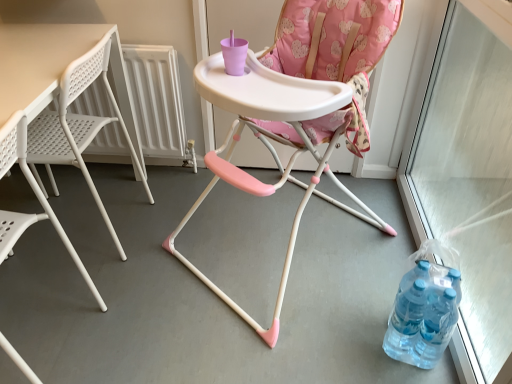
This screenshot has width=512, height=384. Find the location of `free spot to the left of transparent plastic screen door at right`. free spot to the left of transparent plastic screen door at right is located at coordinates (286, 300).